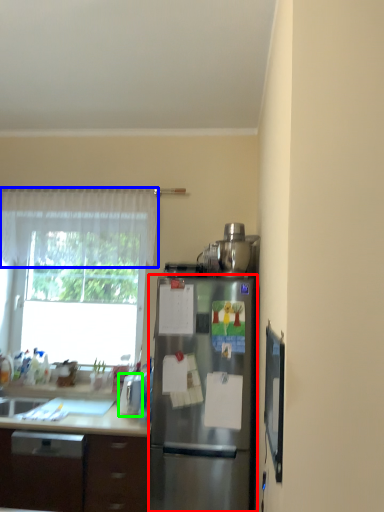
Question: Which object is positioned closest to refrigerator (highlighted by a red box)? Select from curtain (highlighted by a blue box) and appliance (highlighted by a green box).

Choices:
 (A) curtain
 (B) appliance

Answer: (B)